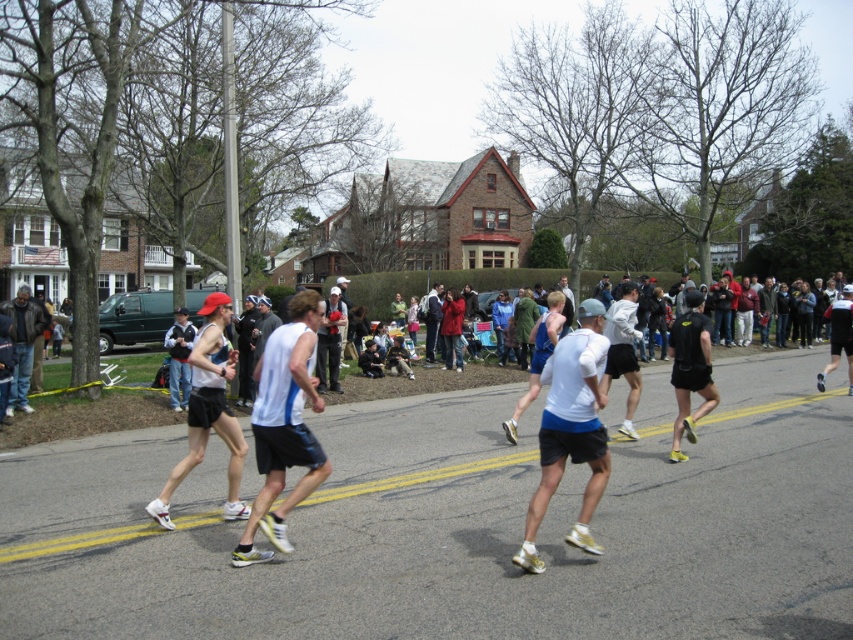
Does dark gray leather jacket at left appear on the right side of matte white tank top at center?

No, dark gray leather jacket at left is not to the right of matte white tank top at center.

Between dark gray leather jacket at left and matte white tank top at center, which one is positioned lower?

matte white tank top at center is below.

Find the location of a particular element. The width and height of the screenshot is (853, 640). dark gray leather jacket at left is located at coordinates (22, 344).

The image size is (853, 640). What do you see at coordinates (283, 426) in the screenshot?
I see `white matte tank top at center` at bounding box center [283, 426].

Between white matte tank top at center and dark gray leather jacket at left, which one is positioned higher?

dark gray leather jacket at left

Where is `white matte tank top at center`? white matte tank top at center is located at coordinates (283, 426).

Where is `white matte tank top at center`? This screenshot has width=853, height=640. white matte tank top at center is located at coordinates [283, 426].

Between white matte shirt at center and matte white tank top at center, which one is positioned higher?

matte white tank top at center

Does white matte shirt at center appear on the left side of matte white tank top at center?

In fact, white matte shirt at center is to the right of matte white tank top at center.

Consider the image. Who is more distant from viewer, (x=599, y=490) or (x=192, y=330)?

The point (x=192, y=330) is more distant.

This screenshot has width=853, height=640. Identify the location of white matte shirt at center. (572, 429).